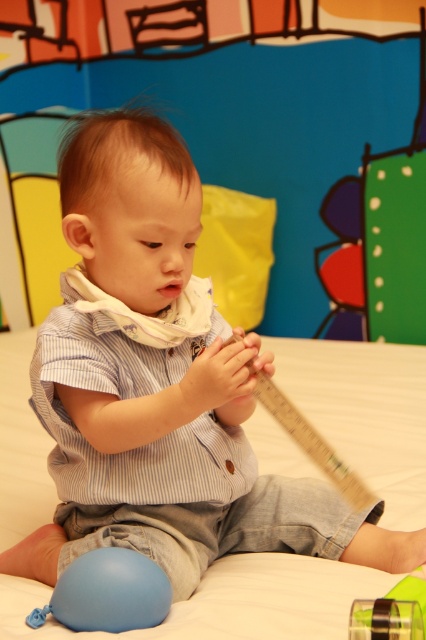
You are a parent trying to reach your child who is sitting at point (98, 618). If your arm can extend 90 centimeters, can you safely reach them?

The distance between you and the child at point (98, 618) is 89.61 centimeters, so yes, you can safely reach them since your arm can extend 90 centimeters.

You are a child trying to find the middle of the wooden ruler at center. You see a point marked at coordinates (310, 442). Is this point the middle of the wooden ruler at center?

The point (310, 442) is on the wooden ruler at center, but without knowing the ruler length or the coordinate system, we can not confirm if it is the middle.

Based on the scene description, where is the wooden ruler at center located in terms of its 2D coordinates?

The wooden ruler at center is located at the 2D coordinates point (310, 442).